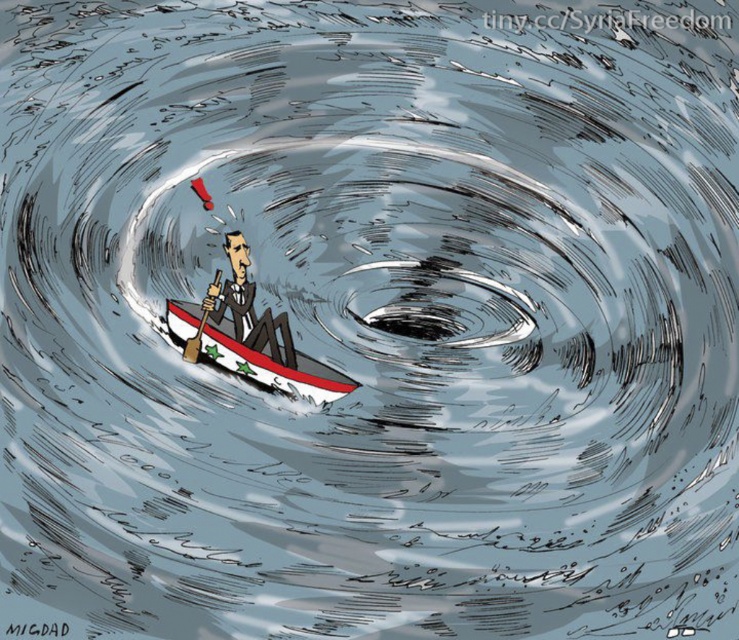
Which of these two, white glossy boat at center or brown wood paddle at center, stands shorter?

Standing shorter between the two is white glossy boat at center.

Describe the element at coordinates (275, 369) in the screenshot. I see `white glossy boat at center` at that location.

Which is behind, point (350, 390) or point (197, 328)?

The point (197, 328) is more distant.

You are a GUI agent. You are given a task and a screenshot of the screen. Output one action in this format:
    pyautogui.click(x=<x>, y=<y>)
    Task: Click on the white glossy boat at center
    The height and width of the screenshot is (640, 739).
    Given the screenshot: What is the action you would take?
    pyautogui.click(x=275, y=369)

In the scene shown: Is white glossy boat at center shorter than dark gray suit at center?

Yes.

Consider the image. Between white glossy boat at center and dark gray suit at center, which one is positioned higher?

dark gray suit at center is higher up.

Is point (228, 349) more distant than point (251, 332)?

No, (228, 349) is in front of (251, 332).

At what (x,y) coordinates should I click in order to perform the action: click on white glossy boat at center. Please return your answer as a coordinate pair (x, y). This screenshot has height=640, width=739. Looking at the image, I should click on pos(275,369).

Which is behind, point (282, 355) or point (197, 339)?

The point (282, 355) is more distant.

The height and width of the screenshot is (640, 739). What do you see at coordinates (248, 307) in the screenshot?
I see `dark gray suit at center` at bounding box center [248, 307].

Where is `dark gray suit at center`? The height and width of the screenshot is (640, 739). dark gray suit at center is located at coordinates (248, 307).